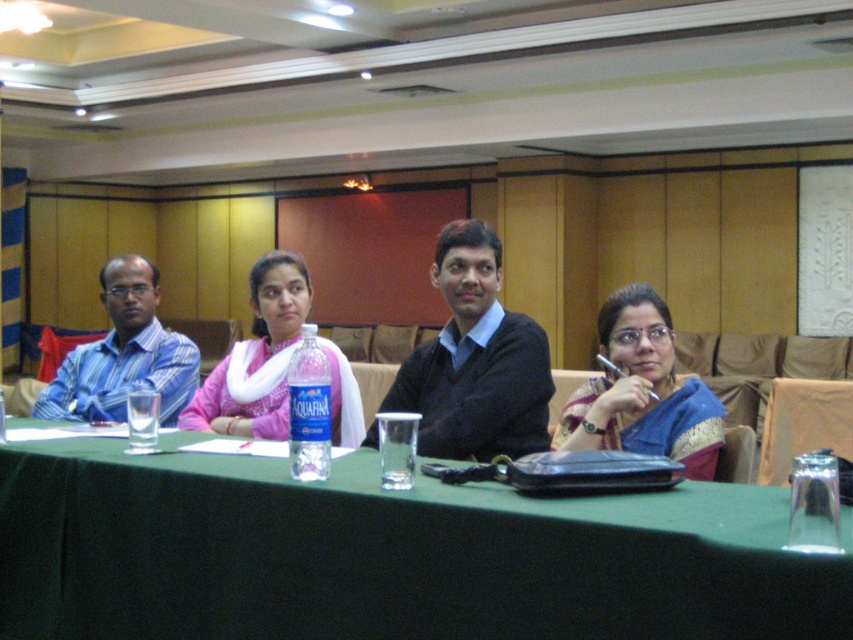
You are organizing a small event and need to place a decorative centerpiece between the black sweater at center and the blue silk saree at center. What is the minimum width the centerpiece should have to fit between them?

The distance between the black sweater at center and the blue silk saree at center is 12.98 inches, so the centerpiece should be at least 12.98 inches wide to fit between them.

You are standing at the entrance of the conference room. You need to locate the blue silk saree at center. According to the coordinates provided, in which direction should you look relative to the table?

The blue silk saree at center is located at coordinates point (642,392), which means it is positioned towards the upper right of the table. Therefore, you should look towards the upper right direction relative to the table to find it.